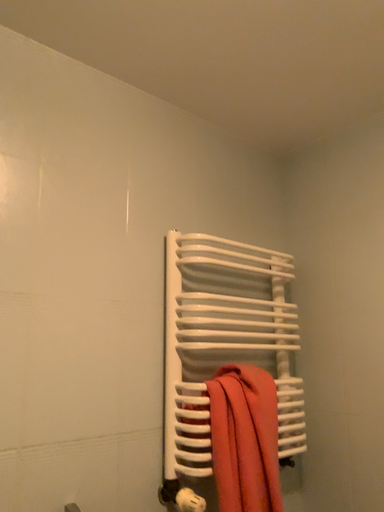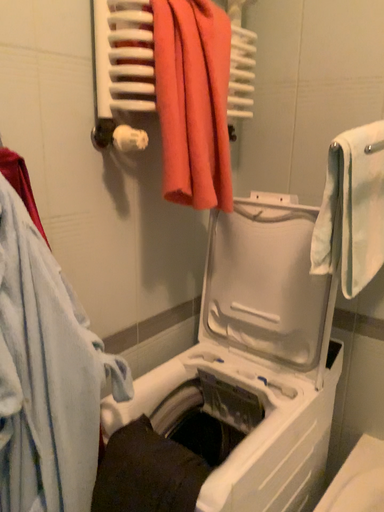
Question: How did the camera likely rotate when shooting the video?

Choices:
 (A) rotated downward
 (B) rotated upward

Answer: (A)